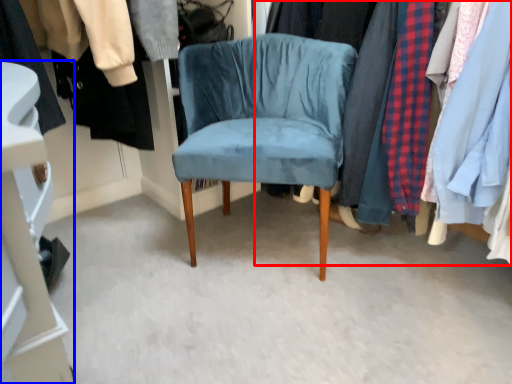
Question: Which point is further to the camera, closet (highlighted by a red box) or closet (highlighted by a blue box)?

Choices:
 (A) closet
 (B) closet

Answer: (B)